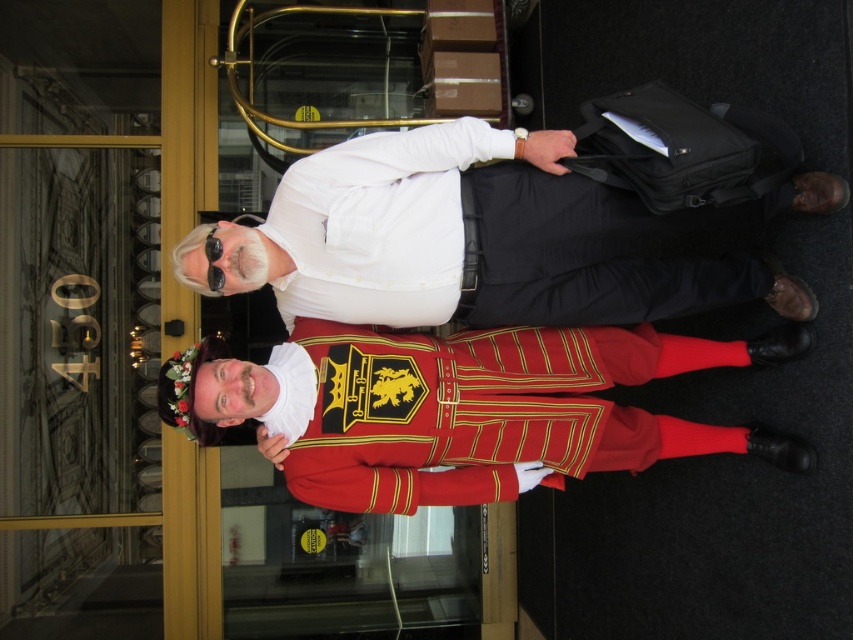
You are a photographer adjusting your camera settings. You notice the white matte shirt at upper center and the shiny red uniform at center. Which object should you focus on first if you want to capture the larger one in detail?

The white matte shirt at upper center is bigger than the shiny red uniform at center, so you should focus on the white matte shirt at upper center first to capture its details.

You are a photographer trying to capture a clear shot of both the white matte shirt at upper center and the shiny red uniform at center. Which object should you focus on first if you want to ensure both are in focus?

The white matte shirt at upper center is positioned on the right side of the shiny red uniform at center. To ensure both are in focus, you should focus on the shiny red uniform at center first since it is closer to the camera, and the depth of field will naturally include the white matte shirt at upper center which is further away.